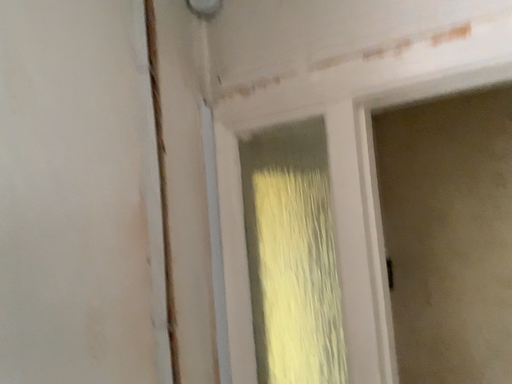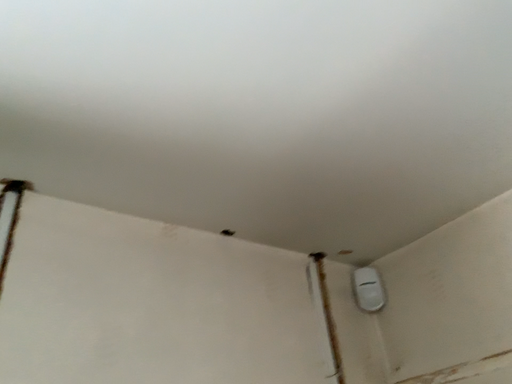
Question: Which way did the camera rotate in the video?

Choices:
 (A) rotated upward
 (B) rotated downward

Answer: (A)